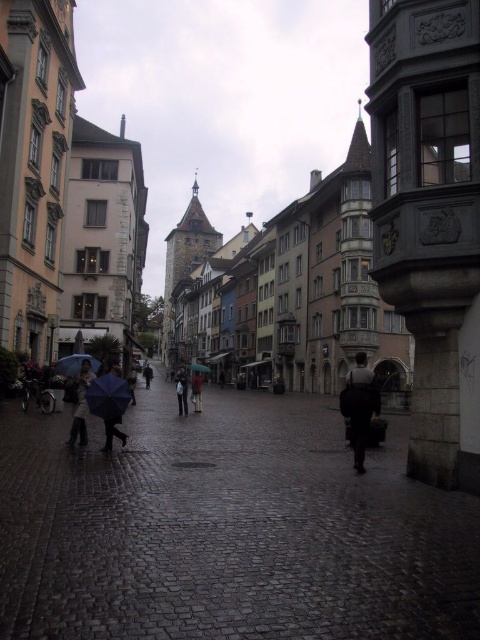
You are a tourist holding an umbrella and standing on the cobblestone street. You notice a dark brown leather jacket at center and a blue matte umbrella at center. Which object is nearer to you?

The dark brown leather jacket at center is closer to you than the blue matte umbrella at center.

You are standing on the cobblestone street and want to walk towards the building with the light peach color on the left. Which point, point (194, 410) or point (205, 365), is closer to you as you face the building?

Point (194, 410) is closer to you than point (205, 365).